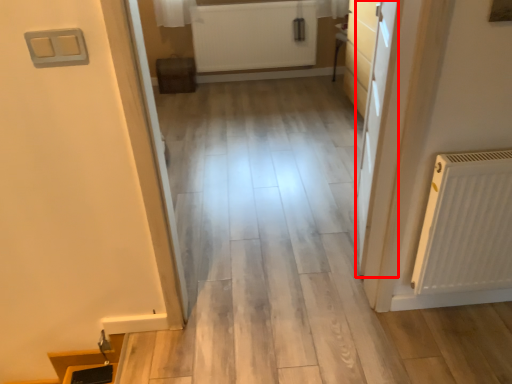
Question: In this image, where is door (annotated by the red box) located relative to radiator?

Choices:
 (A) right
 (B) left

Answer: (A)